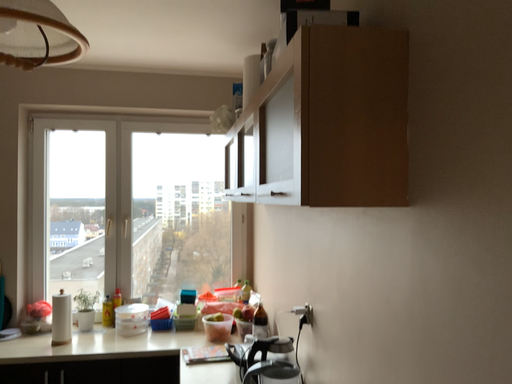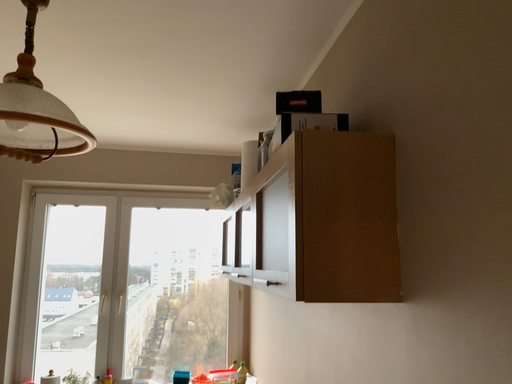
Question: How did the camera likely rotate when shooting the video?

Choices:
 (A) rotated upward
 (B) rotated downward

Answer: (A)